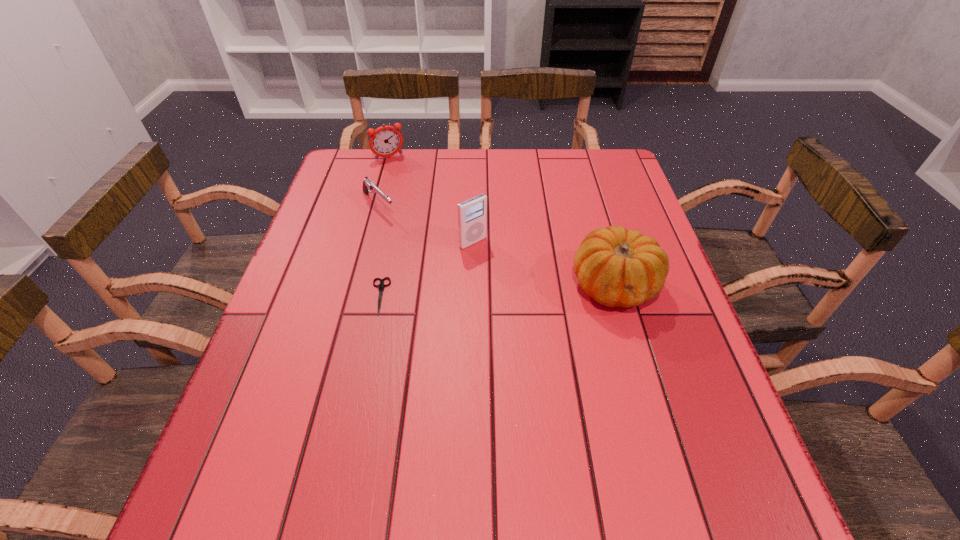
Identify the location of pistol at the left edge. This screenshot has width=960, height=540. (368, 186).

Locate an element on the screen. The height and width of the screenshot is (540, 960). alarm clock that is at the left edge is located at coordinates (385, 141).

Identify the location of object that is positioned at the right edge. [x=616, y=267].

Locate an element on the screen. pistol that is at the far left corner is located at coordinates (368, 186).

Identify the location of alarm clock situated at the far left corner. This screenshot has height=540, width=960. (385, 141).

Where is `vacant space at the far edge of the desktop`? The height and width of the screenshot is (540, 960). vacant space at the far edge of the desktop is located at coordinates (546, 180).

In the image, there is a desktop. Identify the location of vacant region at the near edge. This screenshot has height=540, width=960. (591, 421).

The width and height of the screenshot is (960, 540). In the image, there is a desktop. In order to click on vacant space at the left edge in this screenshot , I will do `click(334, 307)`.

The image size is (960, 540). Identify the location of vacant region at the right edge. (624, 217).

This screenshot has width=960, height=540. Identify the location of vacant space at the far left corner. (357, 185).